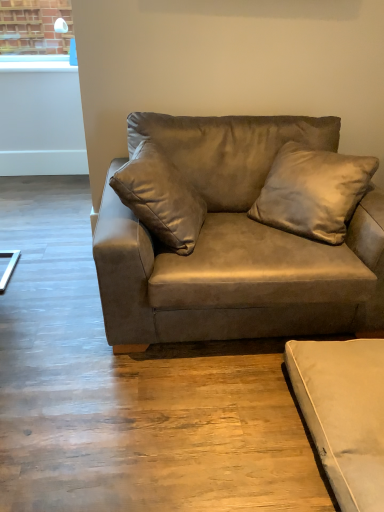
Question: Is beige suede studio couch at lower right, which is the 1th studio couch from bottom to top, at the left side of suede brown couch at center, which is the 2th studio couch in bottom-to-top order?

Choices:
 (A) yes
 (B) no

Answer: (B)

Question: Is beige suede studio couch at lower right, which is the 1th studio couch from bottom to top, facing away from suede brown couch at center, placed as the first studio couch when sorted from top to bottom?

Choices:
 (A) yes
 (B) no

Answer: (B)

Question: Is beige suede studio couch at lower right, which is the 1th studio couch from bottom to top, positioned behind suede brown couch at center, placed as the first studio couch when sorted from top to bottom?

Choices:
 (A) no
 (B) yes

Answer: (A)

Question: Is beige suede studio couch at lower right, which is the 1th studio couch from bottom to top, thinner than suede brown couch at center, which is the 2th studio couch in bottom-to-top order?

Choices:
 (A) yes
 (B) no

Answer: (A)

Question: Is beige suede studio couch at lower right, which is the 1th studio couch from bottom to top, bigger than suede brown couch at center, which is the 2th studio couch in bottom-to-top order?

Choices:
 (A) no
 (B) yes

Answer: (A)

Question: Based on their positions, is beige suede studio couch at lower right, which is the 1th studio couch from bottom to top, located to the left or right of suede brown couch at center, which is the 2th studio couch in bottom-to-top order?

Choices:
 (A) right
 (B) left

Answer: (A)

Question: From the image's perspective, is beige suede studio couch at lower right, which is the 1th studio couch from bottom to top, located above or below suede brown couch at center, which is the 2th studio couch in bottom-to-top order?

Choices:
 (A) above
 (B) below

Answer: (B)

Question: Is beige suede studio couch at lower right, which is the 1th studio couch from bottom to top, in front of or behind suede brown couch at center, placed as the first studio couch when sorted from top to bottom, in the image?

Choices:
 (A) front
 (B) behind

Answer: (A)

Question: Does point 359,470 appear closer or farther from the camera than point 271,323?

Choices:
 (A) farther
 (B) closer

Answer: (B)

Question: Is point (340, 229) closer or farther from the camera than point (178, 260)?

Choices:
 (A) closer
 (B) farther

Answer: (B)

Question: Is suede-like beige pillow at upper center wider or thinner than suede brown couch at center, placed as the first studio couch when sorted from top to bottom?

Choices:
 (A) thin
 (B) wide

Answer: (A)

Question: In the image, is suede-like beige pillow at upper center positioned in front of or behind suede brown couch at center, placed as the first studio couch when sorted from top to bottom?

Choices:
 (A) behind
 (B) front

Answer: (A)

Question: From a real-world perspective, is suede-like beige pillow at upper center above or below suede brown couch at center, placed as the first studio couch when sorted from top to bottom?

Choices:
 (A) below
 (B) above

Answer: (B)

Question: Considering their positions, is suede brown couch at center, placed as the first studio couch when sorted from top to bottom, located in front of or behind beige suede studio couch at lower right, which appears as the 2th studio couch when viewed from the top?

Choices:
 (A) behind
 (B) front

Answer: (A)

Question: Looking at their shapes, would you say suede brown couch at center, which is the 2th studio couch in bottom-to-top order, is wider or thinner than beige suede studio couch at lower right, which is the 1th studio couch from bottom to top?

Choices:
 (A) thin
 (B) wide

Answer: (B)